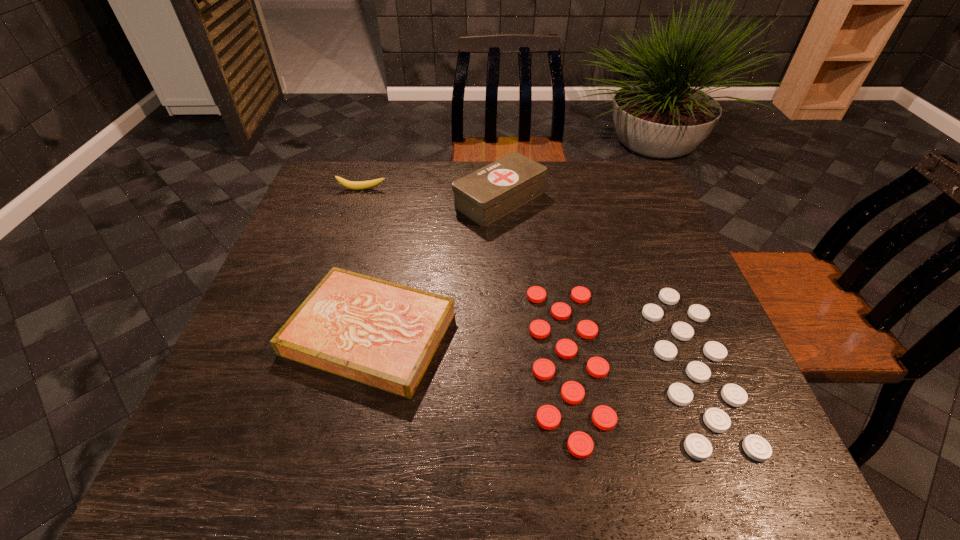
Locate an element on the screen. The image size is (960, 540). object at the near edge is located at coordinates (580, 444).

I want to click on banana present at the left edge, so click(354, 185).

Identify the location of hardback book present at the left edge. (382, 334).

Identify the location of object located in the right edge section of the desktop. (580, 444).

Where is `object positioned at the far left corner`? object positioned at the far left corner is located at coordinates (354, 185).

Locate an element on the screen. This screenshot has height=540, width=960. object that is at the near right corner is located at coordinates (580, 444).

The height and width of the screenshot is (540, 960). I want to click on free space at the far edge of the desktop, so click(382, 203).

In order to click on vacant space at the near edge in this screenshot , I will do `click(475, 437)`.

The image size is (960, 540). In order to click on blank space at the left edge of the desktop in this screenshot , I will do `click(232, 364)`.

The width and height of the screenshot is (960, 540). Find the location of `vacant space at the right edge of the desktop`. vacant space at the right edge of the desktop is located at coordinates (673, 237).